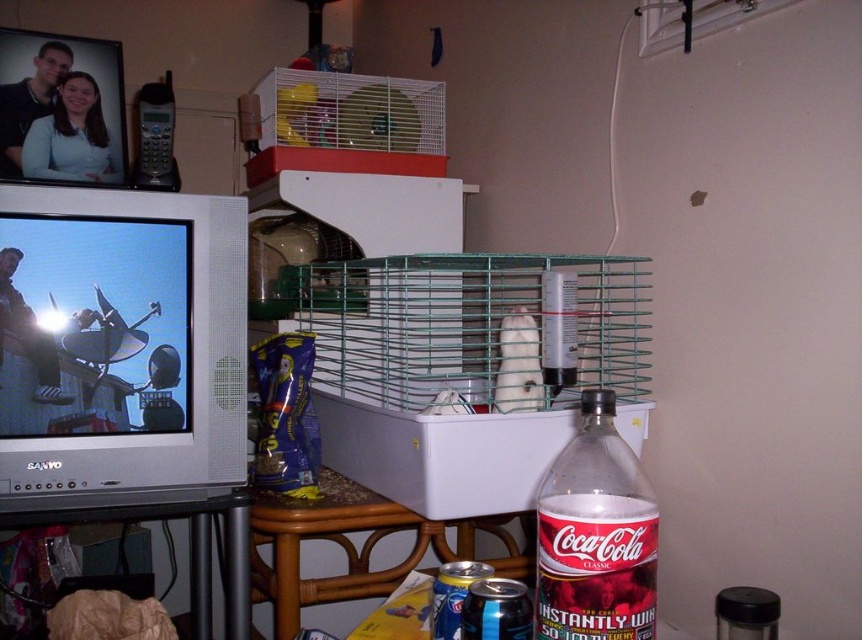
You are standing in the living room and want to place a new plant on the table. The plant requires a spot that is not directly under the green wire birdcage at upper center. Based on the coordinates provided, where should you place the plant?

The green wire birdcage at upper center is located at coordinates (342,124). To avoid placing the plant directly under it, choose a spot on the table that is not aligned with these coordinates.

From the picture: You are organizing a small party and need to place a 15cm wide decorative item between the green wire birdcage at upper center and the white matte hamster at center. Is there enough space?

The green wire birdcage at upper center is positioned on the left side of white matte hamster at center, so there is space between them. The decorative item can be placed there if the distance between them is at least 15cm. However, the exact distance isn not provided, so it depends on the actual spacing.